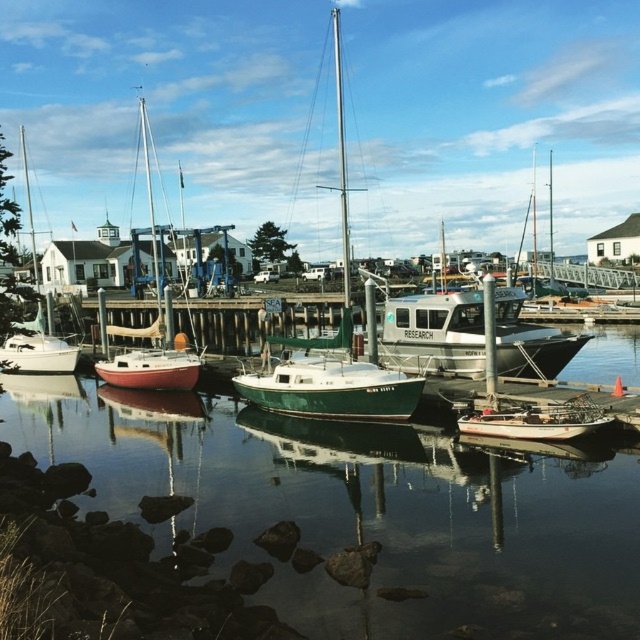
Does green matte sailboat at center appear over wooden boat at lower right?

Correct, green matte sailboat at center is located above wooden boat at lower right.

Is green matte sailboat at center below wooden boat at lower right?

No.

Is point (304, 404) positioned in front of point (468, 422)?

That is False.

Where is `green matte sailboat at center`? green matte sailboat at center is located at coordinates (333, 346).

Is wooden boat at lower right in front of matte white sailboat at center?

Yes, it is.

The image size is (640, 640). I want to click on wooden boat at lower right, so click(x=536, y=420).

At what (x,y) coordinates should I click in order to perform the action: click on wooden boat at lower right. Please return your answer as a coordinate pair (x, y). Image resolution: width=640 pixels, height=640 pixels. Looking at the image, I should click on (536, 420).

Does point (513, 538) lie in front of point (518, 436)?

Yes, point (513, 538) is in front of point (518, 436).

Between green matte water at center and wooden boat at lower right, which one has less height?

wooden boat at lower right is shorter.

Who is more distant from viewer, [77,404] or [522,429]?

Positioned behind is point [77,404].

Identify the location of green matte water at center. This screenshot has height=640, width=640. (358, 509).